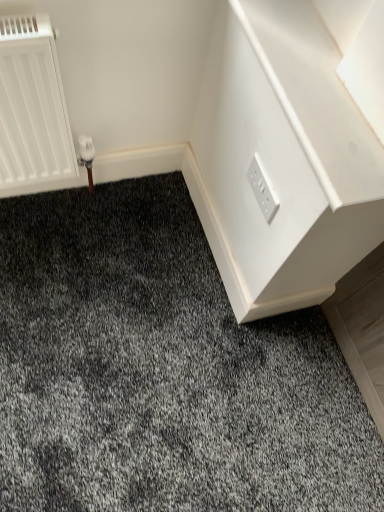
Question: From a real-world perspective, is white glossy dresser at upper right physically located above or below white plastic power plugs and sockets at upper right?

Choices:
 (A) above
 (B) below

Answer: (A)

Question: In terms of size, does white glossy dresser at upper right appear bigger or smaller than white plastic power plugs and sockets at upper right?

Choices:
 (A) small
 (B) big

Answer: (B)

Question: Do you think white glossy dresser at upper right is within white plastic power plugs and sockets at upper right, or outside of it?

Choices:
 (A) inside
 (B) outside

Answer: (B)

Question: Is white plastic power plugs and sockets at upper right spatially inside white glossy dresser at upper right, or outside of it?

Choices:
 (A) outside
 (B) inside

Answer: (A)

Question: From a real-world perspective, relative to white glossy dresser at upper right, is white plastic power plugs and sockets at upper right vertically above or below?

Choices:
 (A) above
 (B) below

Answer: (B)

Question: In terms of height, does white plastic power plugs and sockets at upper right look taller or shorter compared to white glossy dresser at upper right?

Choices:
 (A) tall
 (B) short

Answer: (A)

Question: In terms of size, does white plastic power plugs and sockets at upper right appear bigger or smaller than white glossy dresser at upper right?

Choices:
 (A) big
 (B) small

Answer: (B)